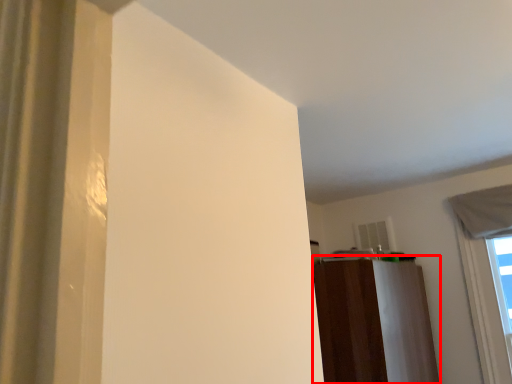
Question: Where is dresser (annotated by the red box) located in relation to window in the image?

Choices:
 (A) right
 (B) left

Answer: (B)